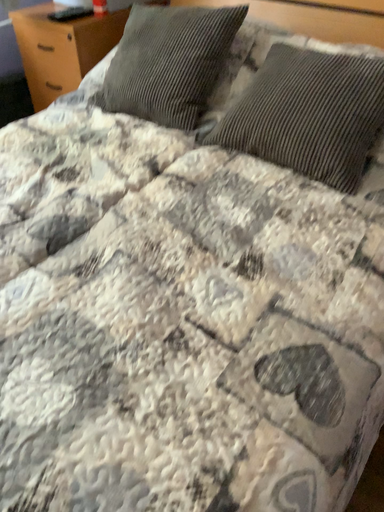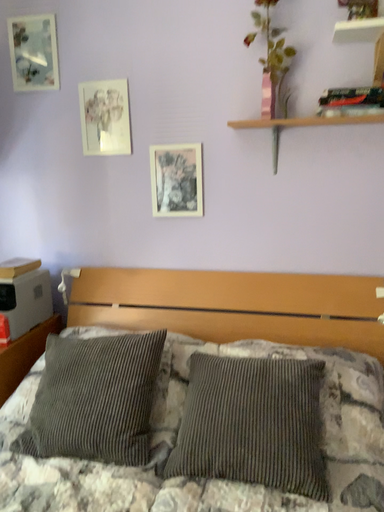
Question: How did the camera likely rotate when shooting the video?

Choices:
 (A) rotated downward
 (B) rotated upward

Answer: (B)